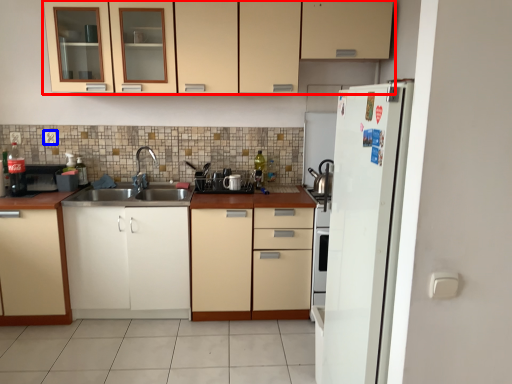
Question: Which object appears closest to the camera in this image, cabinetry (highlighted by a red box) or electric outlet (highlighted by a blue box)?

Choices:
 (A) cabinetry
 (B) electric outlet

Answer: (A)